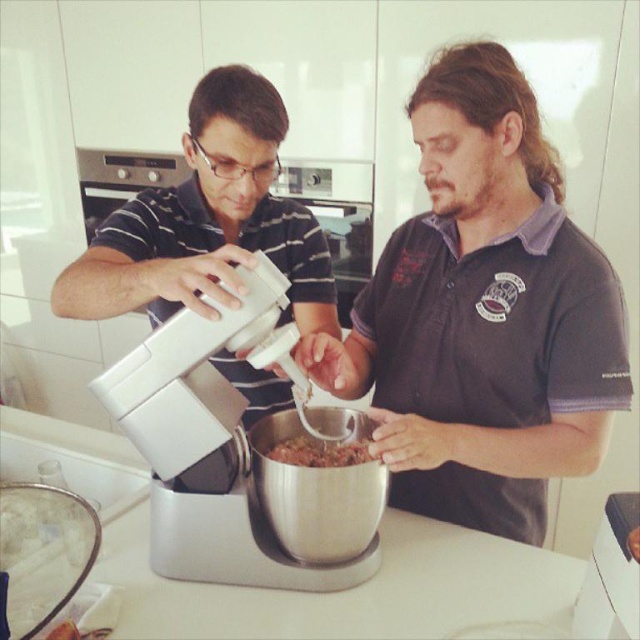
You are a chef standing in the kitchen and need to reach for the silver metallic mixer at center. Considering the dark gray shirt at center is blocking your view, can you still access the mixer?

The dark gray shirt at center is much taller than the silver metallic mixer at center, so the shirt may block access to the mixer. You might need to ask the person wearing the dark gray shirt at center to move or step aside to reach the mixer.

You are a chef preparing a recipe that requires precise measurements. You have a white matte mixer at center and a brown crumbly mixture at center on the counter. Which object should you use to measure the exact amount of the mixture needed for the recipe?

The brown crumbly mixture at center is the mixture itself, so you should use the white matte mixer at center to measure the exact amount needed for the recipe.

You are standing at the point marked as point (x=536, y=365) in the kitchen. You need to hand a 1.2 meter long wooden stick to someone who is holding the camera. Can you reach them without moving from your current position?

The distance between point (x=536, y=365) and the camera is 1.05 meters. Since the wooden stick is 1.2 meters long, which is longer than the distance between you and the camera, you can reach them by extending the stick.